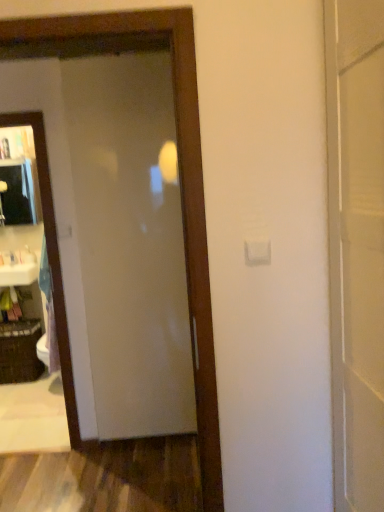
Question: Would you say matte black medicine cabinet at left contains matte glass door at center?

Choices:
 (A) no
 (B) yes

Answer: (A)

Question: Does matte black medicine cabinet at left have a lesser width compared to matte glass door at center?

Choices:
 (A) no
 (B) yes

Answer: (A)

Question: Is matte black medicine cabinet at left positioned behind matte glass door at center?

Choices:
 (A) yes
 (B) no

Answer: (A)

Question: Can you confirm if matte black medicine cabinet at left is shorter than matte glass door at center?

Choices:
 (A) no
 (B) yes

Answer: (B)

Question: Is matte black medicine cabinet at left beside matte glass door at center?

Choices:
 (A) no
 (B) yes

Answer: (A)

Question: Is matte black medicine cabinet at left not within matte glass door at center?

Choices:
 (A) no
 (B) yes

Answer: (B)

Question: Is white plastic bag at left closer to camera compared to white glossy sink at left?

Choices:
 (A) no
 (B) yes

Answer: (A)

Question: Does white plastic bag at left appear on the left side of white glossy sink at left?

Choices:
 (A) no
 (B) yes

Answer: (A)

Question: From the image's perspective, is white plastic bag at left over white glossy sink at left?

Choices:
 (A) no
 (B) yes

Answer: (B)

Question: Is the position of white plastic bag at left more distant than that of white glossy sink at left?

Choices:
 (A) yes
 (B) no

Answer: (A)

Question: From the image's perspective, is white plastic bag at left under white glossy sink at left?

Choices:
 (A) yes
 (B) no

Answer: (B)

Question: Are white plastic bag at left and white glossy sink at left far apart?

Choices:
 (A) no
 (B) yes

Answer: (A)

Question: Is clear glass mirror at left thinner than black woven basket at lower left?

Choices:
 (A) no
 (B) yes

Answer: (B)